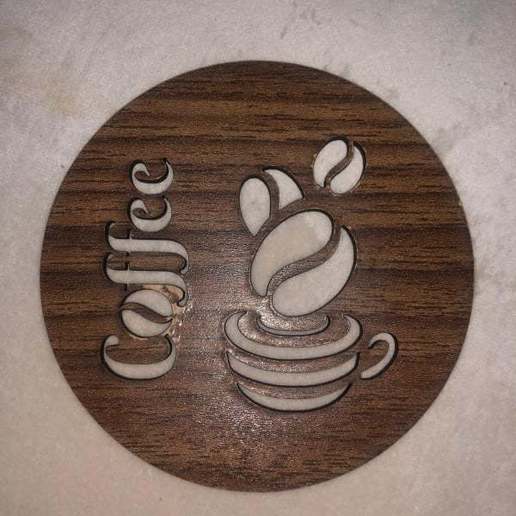
This screenshot has height=516, width=516. I want to click on coffee mug top, so click(x=297, y=319).